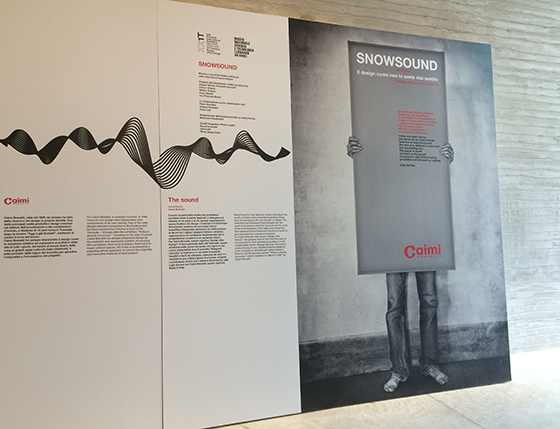
At what (x,y) coordinates should I click in order to perform the action: click on floor. Please return your answer as a coordinate pair (x, y). The height and width of the screenshot is (429, 560). Looking at the image, I should click on (426, 416).